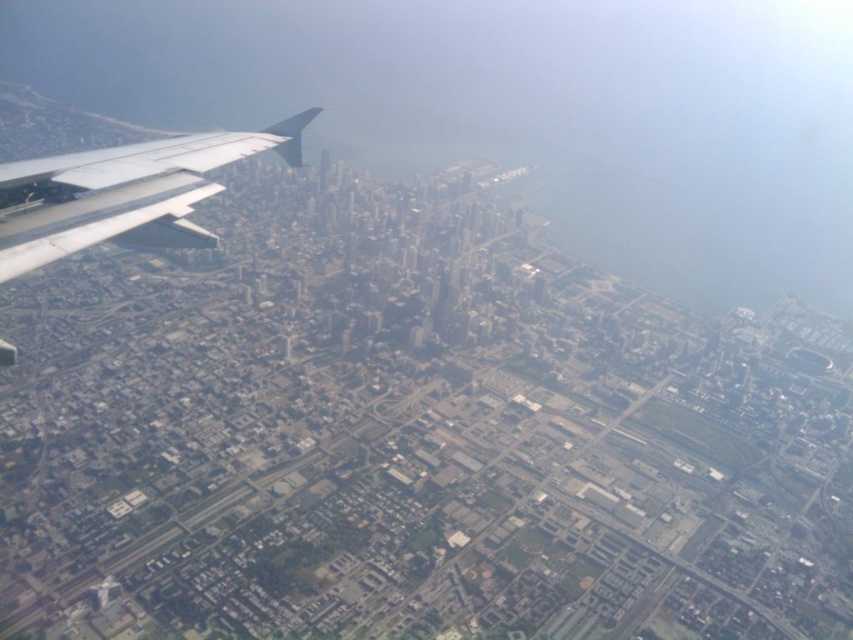
You are a pilot flying over a city. You notice the transparent glass cityscape at upper center and the silver metallic wing at upper left in your view. Which object is closer to you?

The transparent glass cityscape at upper center is closer to you because the silver metallic wing at upper left is behind it.

You are a pilot flying over a city and notice two objects from your window. You see the transparent glass cityscape at upper center and the silver metallic wing at upper left. Which object appears larger in your view?

The transparent glass cityscape at upper center appears larger than the silver metallic wing at upper left.